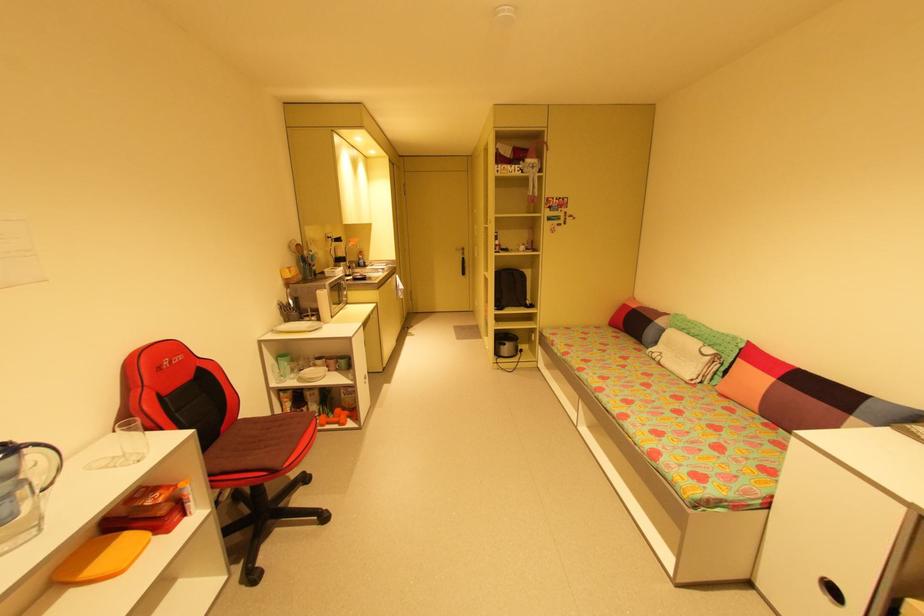
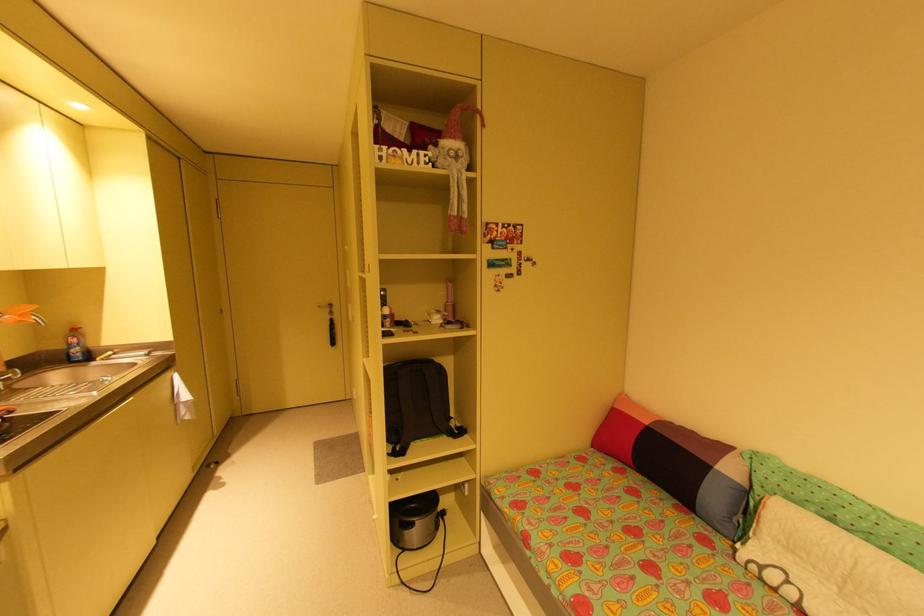
Question: What movement of the cameraman would produce the second image?

Choices:
 (A) Left
 (B) Right
 (C) Forward
 (D) Backward

Answer: (C)